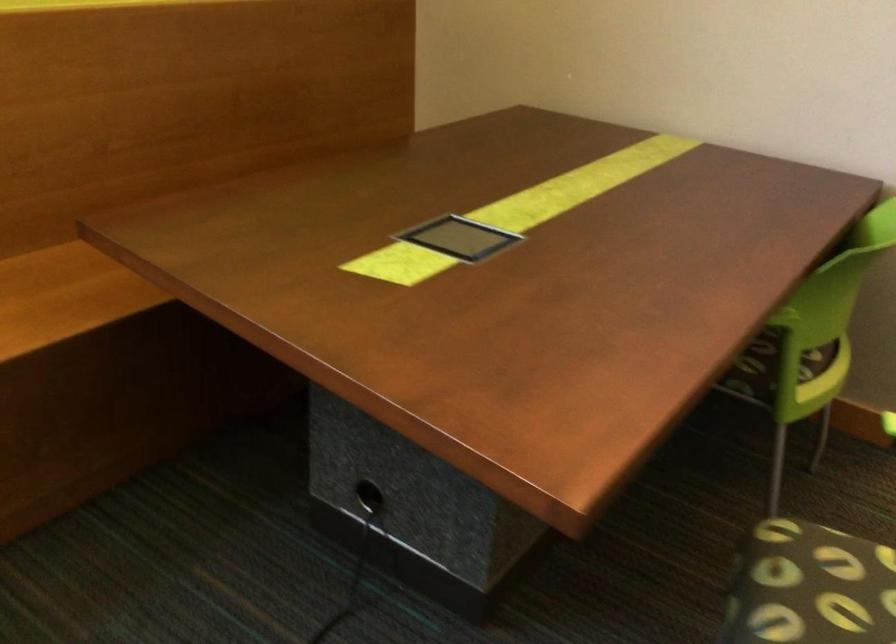
This screenshot has height=644, width=896. Identify the location of table port cover. (460, 238).